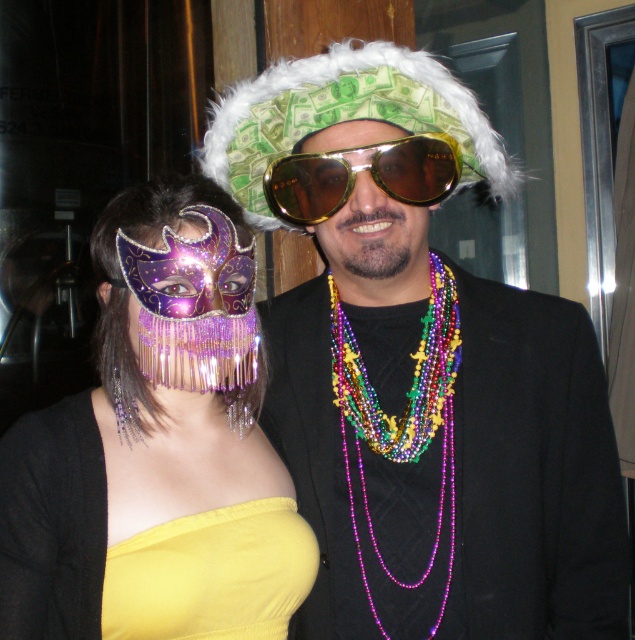
You are standing in a crowd at a Mardi Gras parade and see the shiny gold sunglasses at center. If you want to grab a souvenir from the ground without moving your feet, can you reach the sunglasses?

The shiny gold sunglasses at center is 3.36 feet away from viewer, so you cannot reach it without moving your feet since the average human arm length is about 2.5 feet.

You are standing in front of the two people at a Mardi Gras party. You want to take a photo of the point at coordinates point (93, 564) and point (123, 545). Which point is closer to you?

Point (93, 564) is in front of point (123, 545), so the point (93, 564) is closer to you.

Based on the photo, you are a photographer trying to capture a closeup of both the metallic purple mask at center and the multicolored beaded necklace at center. Based on their sizes, which object should you focus on first to ensure it fits in the frame?

The metallic purple mask at center might be wider than multicolored beaded necklace at center, so you should focus on the metallic purple mask at center first to ensure it fits in the frame.